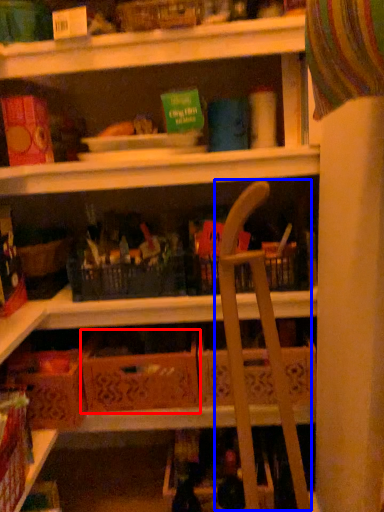
Question: Among these objects, which one is nearest to the camera, cardboard box (highlighted by a red box) or folding chair (highlighted by a blue box)?

Choices:
 (A) cardboard box
 (B) folding chair

Answer: (B)